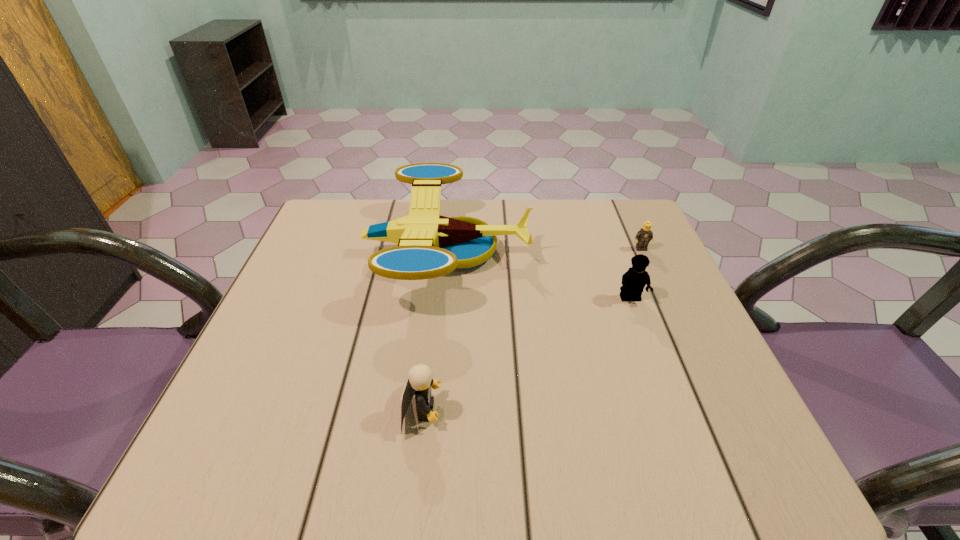
Image resolution: width=960 pixels, height=540 pixels. In order to click on the second closest object relative to the shortest Lego in this screenshot , I will do (x=430, y=245).

The width and height of the screenshot is (960, 540). Identify the location of the second closest object to the drone. (636, 278).

Identify the location of Lego that is the second closest to the shortest object. (420, 381).

You are a GUI agent. You are given a task and a screenshot of the screen. Output one action in this format:
    pyautogui.click(x=<x>, y=<y>)
    Task: Click on the closest Lego to the shortest Lego
    
    Given the screenshot: What is the action you would take?
    pyautogui.click(x=636, y=278)

Where is `vacant position in the image that satisfies the following two spatial constraints: 1. in front of the shortest object; 2. at the cockpit of the drone`? The height and width of the screenshot is (540, 960). vacant position in the image that satisfies the following two spatial constraints: 1. in front of the shortest object; 2. at the cockpit of the drone is located at coordinates (x=642, y=253).

Find the location of `vacant position in the image that satisfies the following two spatial constraints: 1. in front of the rightmost object; 2. on the front-facing side of the nearest Lego`. vacant position in the image that satisfies the following two spatial constraints: 1. in front of the rightmost object; 2. on the front-facing side of the nearest Lego is located at coordinates (713, 410).

Image resolution: width=960 pixels, height=540 pixels. What are the coordinates of `free space that satisfies the following two spatial constraints: 1. in front of the shortest Lego; 2. on the front-facing side of the leftmost Lego` in the screenshot? It's located at tap(713, 410).

At what (x,y) coordinates should I click in order to perform the action: click on vacant area that satisfies the following two spatial constraints: 1. on the front-facing side of the second object from right to left; 2. on the front-facing side of the nearest Lego. Please return your answer as a coordinate pair (x, y). The height and width of the screenshot is (540, 960). Looking at the image, I should click on (671, 410).